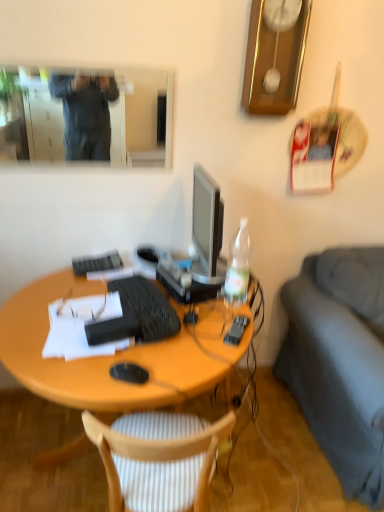
The width and height of the screenshot is (384, 512). Identify the location of free space that is in between black plastic remote control at right and clear plastic bottle at right. (235, 315).